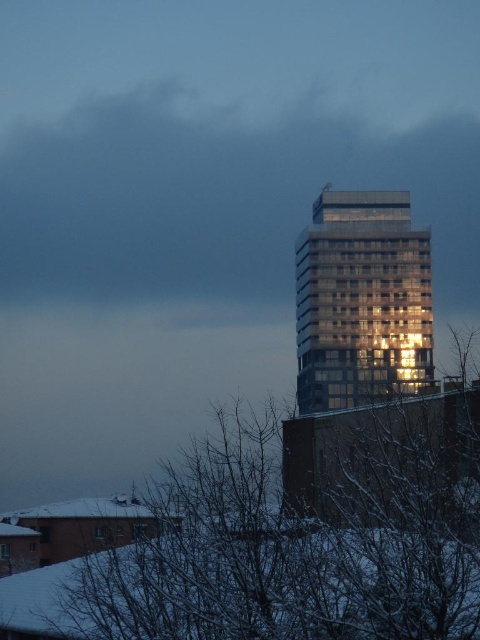
Can you confirm if snowy branches at lower right is wider than reflective glass building at center?

Incorrect, snowy branches at lower right's width does not surpass reflective glass building at center's.

Is snowy branches at lower right shorter than reflective glass building at center?

Yes.

Describe the element at coordinates (303, 532) in the screenshot. I see `snowy branches at lower right` at that location.

I want to click on snowy branches at lower right, so click(x=303, y=532).